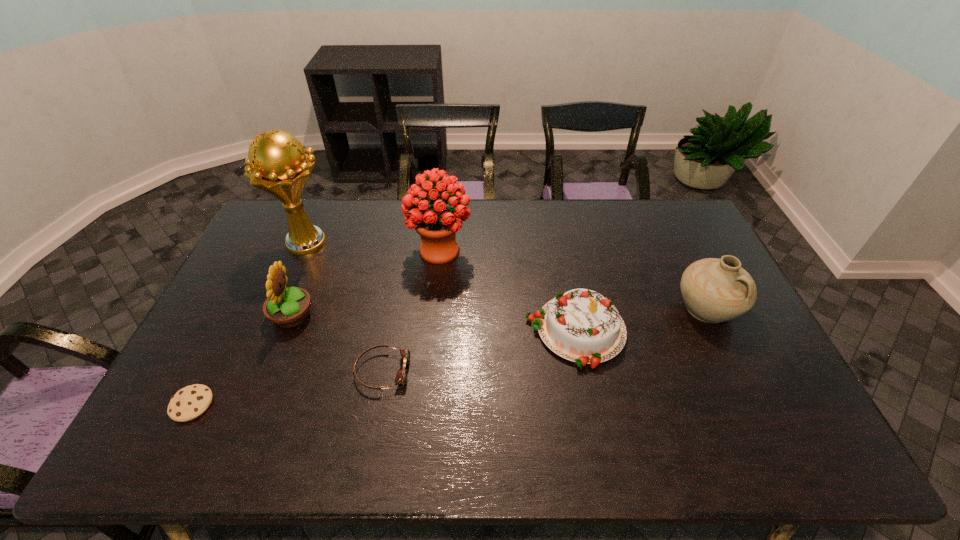
This screenshot has height=540, width=960. Find the location of `free region that satisfies the following two spatial constraints: 1. at the front of the trophy_cup where the globe is prominent; 2. on the back side of the third shortest object`. free region that satisfies the following two spatial constraints: 1. at the front of the trophy_cup where the globe is prominent; 2. on the back side of the third shortest object is located at coordinates (271, 332).